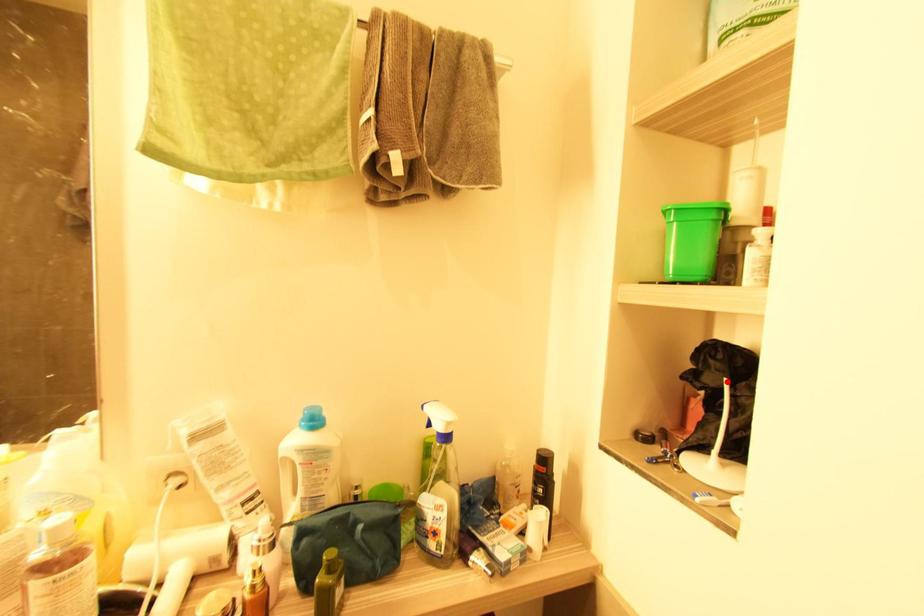
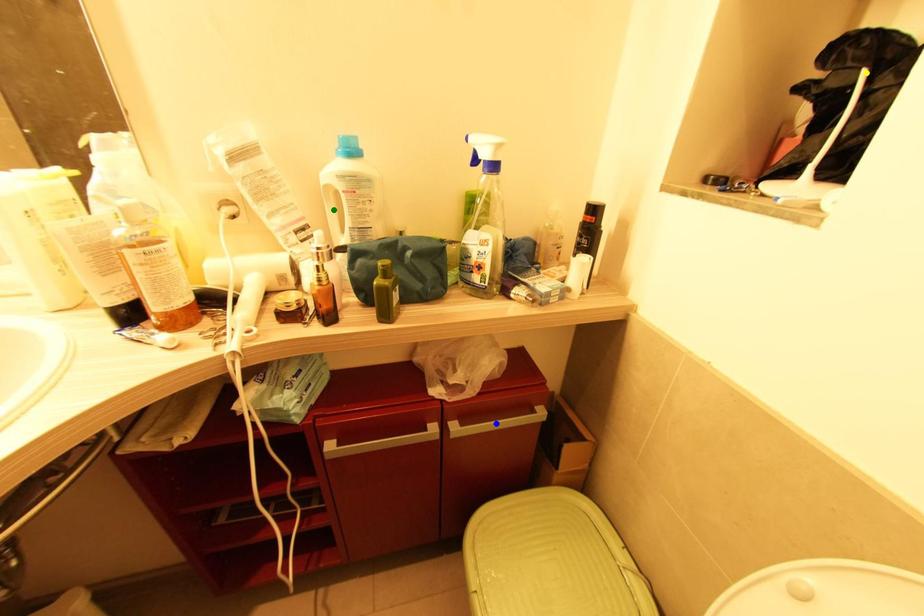
Question: I am providing you with two images of the same scene from different viewpoints. A red point is marked on the first image. You are given multiple points on the second image. Which spot in image 2 lines up with the point in image 1?

Choices:
 (A) yellow point
 (B) green point
 (C) blue point

Answer: (A)